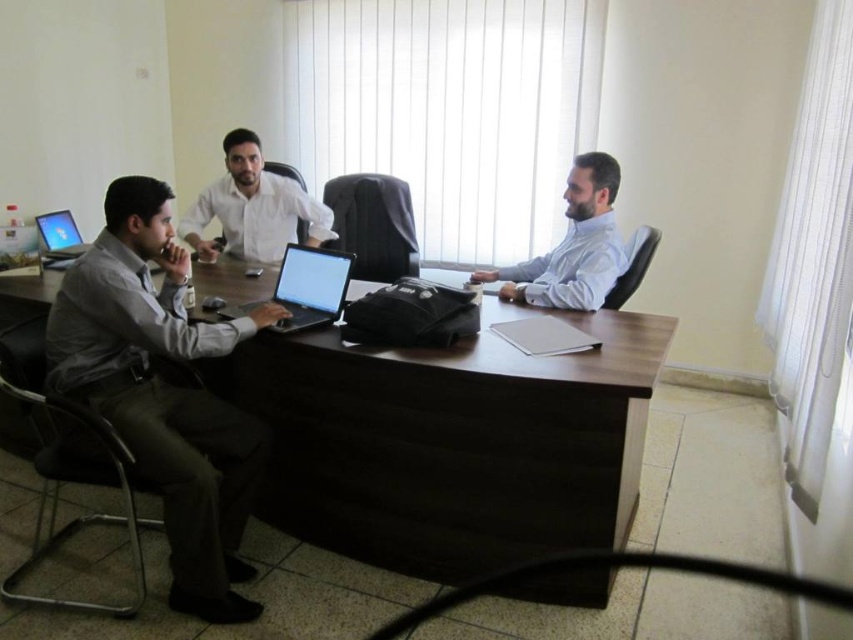
Question: Can you confirm if dark wood table at center is bigger than light blue shirt at right?

Choices:
 (A) yes
 (B) no

Answer: (A)

Question: Which of the following is the closest to the observer?

Choices:
 (A) satin black laptop at left
 (B) white glossy shirt at center
 (C) dark wood table at center
 (D) matte black laptop at left

Answer: (C)

Question: Which object appears closest to the camera in this image?

Choices:
 (A) satin black laptop at left
 (B) matte black laptop at left

Answer: (A)

Question: Observing the image, what is the correct spatial positioning of matte gray shirt at left in reference to satin black laptop at left?

Choices:
 (A) below
 (B) above

Answer: (A)

Question: Which point is farther to the camera?

Choices:
 (A) (285, 202)
 (B) (312, 282)

Answer: (A)

Question: Does white glossy shirt at center appear under satin black laptop at left?

Choices:
 (A) yes
 (B) no

Answer: (B)